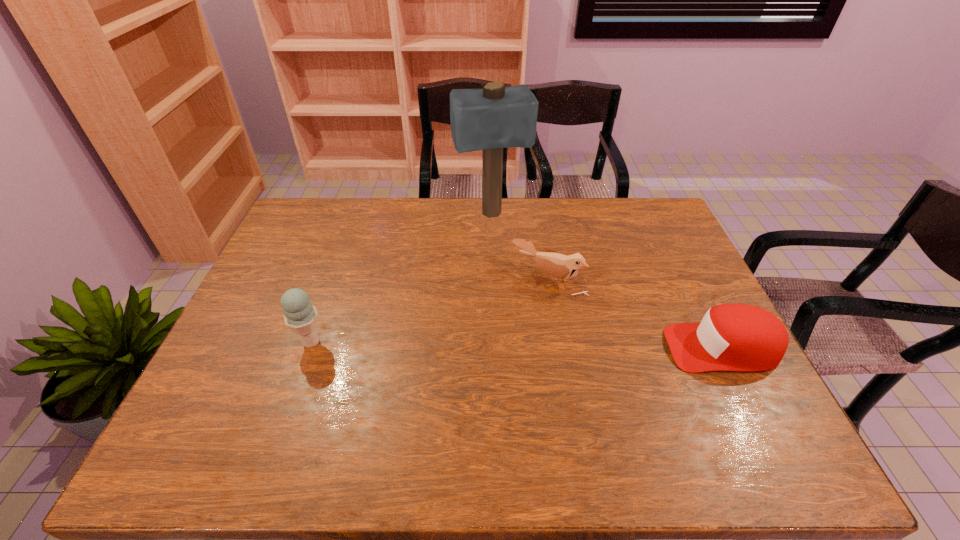
You are a GUI agent. You are given a task and a screenshot of the screen. Output one action in this format:
    pyautogui.click(x=<x>, y=<y>)
    Task: Click on the free spot on the desktop that is between the third shortest object and the baseball cap and is positioned on the striking surface of the mallet
    
    Given the screenshot: What is the action you would take?
    pyautogui.click(x=531, y=345)

The width and height of the screenshot is (960, 540). In order to click on free spot on the desktop that is between the ice cream and the rightmost object and is positioned at the beak of the third nearest object in this screenshot , I will do `click(495, 345)`.